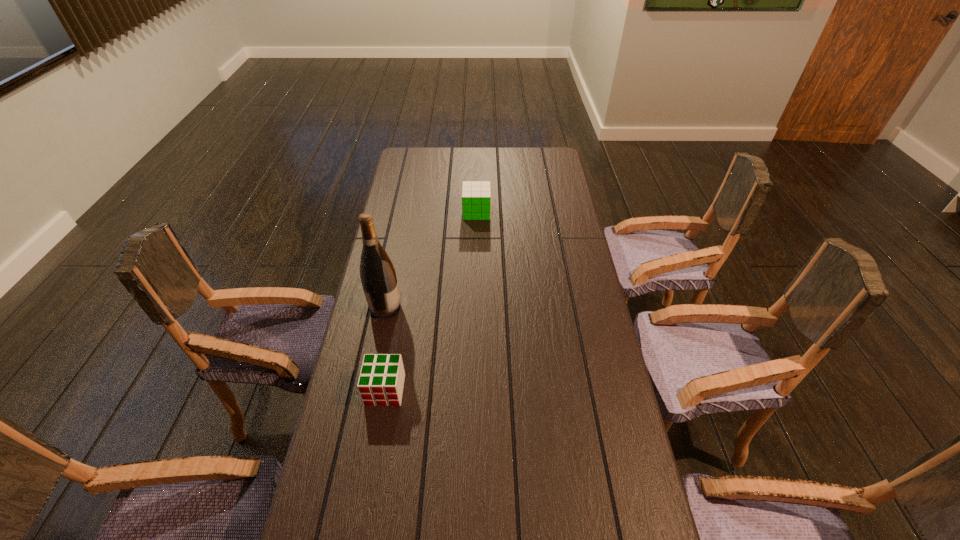
Find the location of a particular element. The width and height of the screenshot is (960, 540). empty space between the second nearest object and the rightmost object is located at coordinates (431, 260).

Find the location of `vacant space that is in between the nearest object and the rightmost object`. vacant space that is in between the nearest object and the rightmost object is located at coordinates (431, 301).

Locate an element on the screen. The width and height of the screenshot is (960, 540). empty space that is in between the tallest object and the left cube is located at coordinates (385, 349).

The width and height of the screenshot is (960, 540). In order to click on free space between the nearer cube and the rightmost object in this screenshot , I will do `click(431, 301)`.

The width and height of the screenshot is (960, 540). Find the location of `vacant space that is in between the wine bottle and the right cube`. vacant space that is in between the wine bottle and the right cube is located at coordinates (431, 260).

Find the location of `the closest object to the nearest object`. the closest object to the nearest object is located at coordinates (378, 277).

Locate an element on the screen. The height and width of the screenshot is (540, 960). object that is the second closest to the farthest object is located at coordinates (381, 381).

Identify the location of vacant space that satisfies the following two spatial constraints: 1. on the front side of the farther cube; 2. on the label of the tallest object. The width and height of the screenshot is (960, 540). [x=475, y=307].

Where is `free space that satisfies the following two spatial constraints: 1. on the front side of the rightmost object; 2. on the label of the wine bottle`? free space that satisfies the following two spatial constraints: 1. on the front side of the rightmost object; 2. on the label of the wine bottle is located at coordinates (475, 307).

Where is `vacant region that satisfies the following two spatial constraints: 1. on the front side of the right cube; 2. on the label of the wine bottle`? The height and width of the screenshot is (540, 960). vacant region that satisfies the following two spatial constraints: 1. on the front side of the right cube; 2. on the label of the wine bottle is located at coordinates (475, 307).